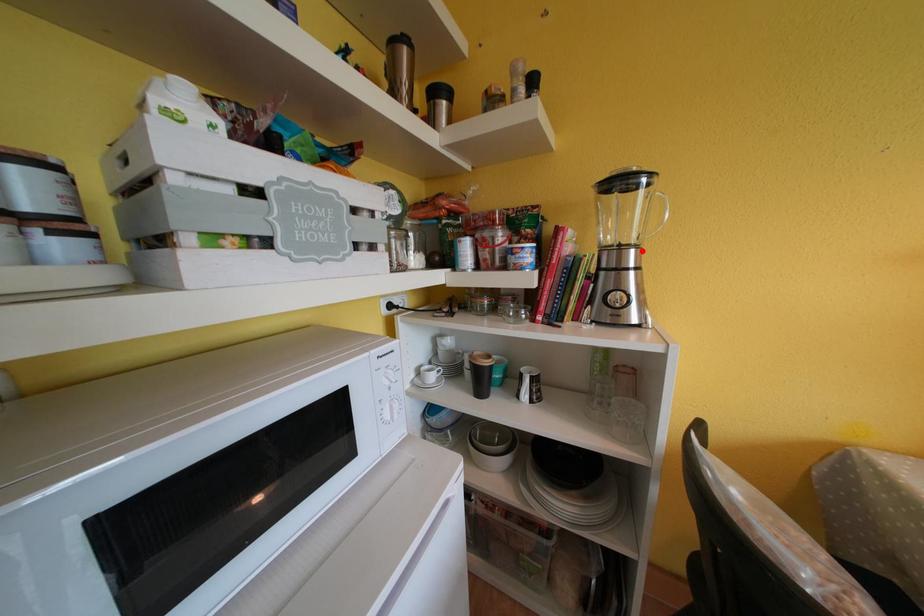
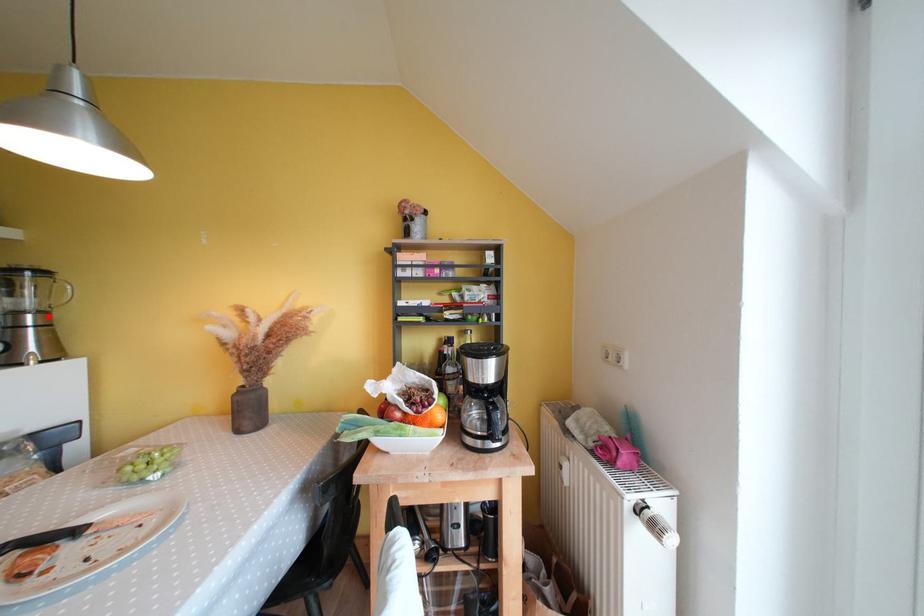
I am providing you with two images of the same scene from different viewpoints. A red point is marked on the first image and another point is marked on the second image. Do the highlighted points in image1 and image2 indicate the same real-world spot?

Yes